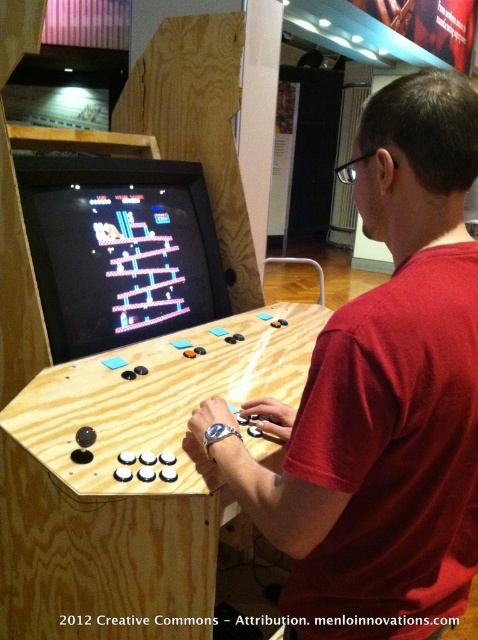
In the scene shown: Can you confirm if matte wood man at center is positioned to the right of wooden arcade cabinet at center?

Indeed, matte wood man at center is positioned on the right side of wooden arcade cabinet at center.

Between matte wood man at center and wooden arcade cabinet at center, which one has more height?

Standing taller between the two is matte wood man at center.

Where is `matte wood man at center`? matte wood man at center is located at coordinates (381, 396).